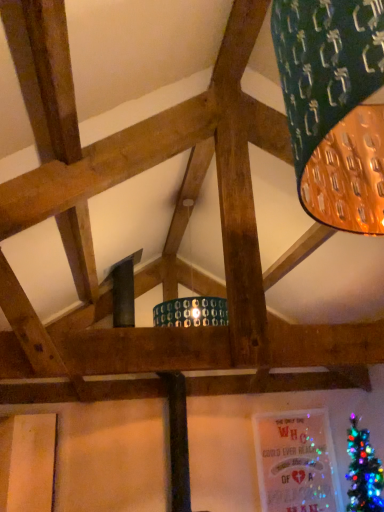
The width and height of the screenshot is (384, 512). I want to click on green textured lampshade at center, so click(x=192, y=303).

This screenshot has width=384, height=512. Describe the element at coordinates (192, 303) in the screenshot. I see `green textured lampshade at center` at that location.

Find the location of a particular element. green textured lampshade at center is located at coordinates (192, 303).